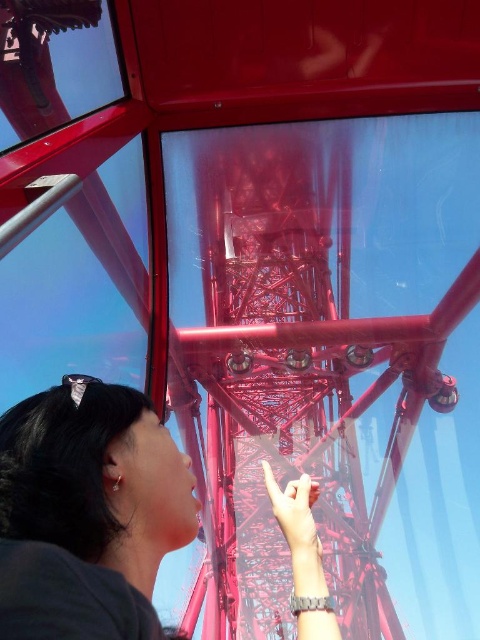
Who is positioned more to the left, metallic red eiffel tower at center or matte black hair at upper left?

matte black hair at upper left

Does metallic red eiffel tower at center have a smaller size compared to matte black hair at upper left?

No, metallic red eiffel tower at center is not smaller than matte black hair at upper left.

Which is in front, point (260, 228) or point (128, 561)?

Positioned in front is point (128, 561).

Where is `metallic red eiffel tower at center`? The image size is (480, 640). metallic red eiffel tower at center is located at coordinates (271, 368).